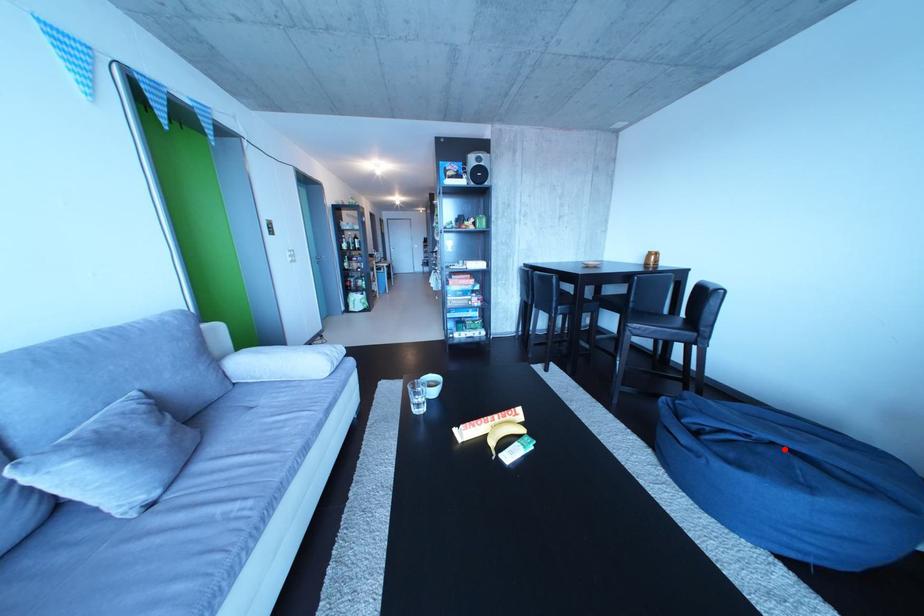
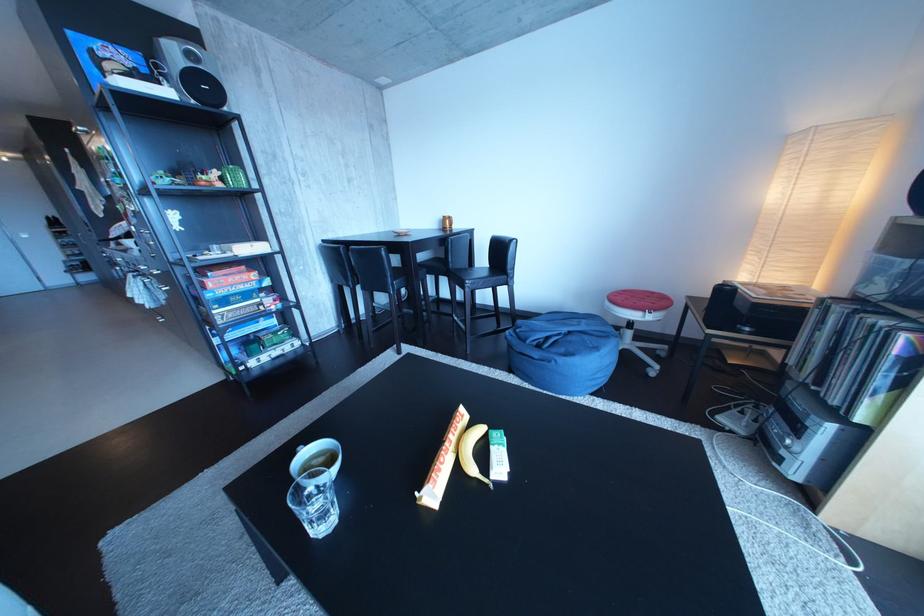
The point at the highlighted location is marked in the first image. Where is the corresponding point in the second image?

(582, 339)